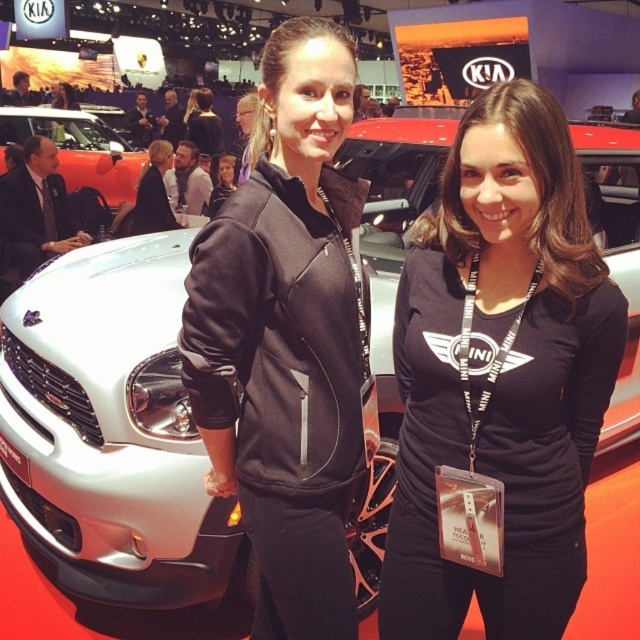
You are a photographer at the auto show. You want to take a photo of the orange matte car at center and the matte black hoodie at center. Considering their heights, which object should you adjust your camera angle to focus on first to ensure both are in frame?

The orange matte car at center is taller than the matte black hoodie at center. To ensure both are in frame, adjust your camera angle to focus on the orange matte car at center first, then lower slightly to include the matte black hoodie at center.